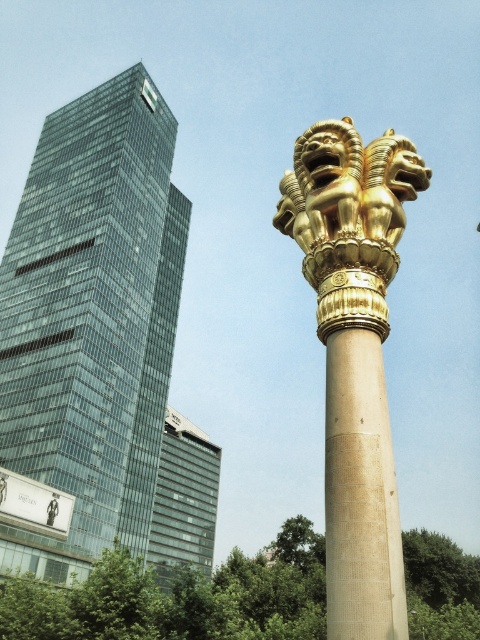
You are a photographer standing in the middle of the square. You want to take a photo that includes both the gold polished column at center and the glassy reflective building at center. Which object should you position closer to the camera to ensure both are in focus?

To ensure both the gold polished column at center and the glassy reflective building at center are in focus, position the gold polished column at center closer to the camera since it is in front of the glassy reflective building at center. This way, the camera can capture both objects within the depth of field.